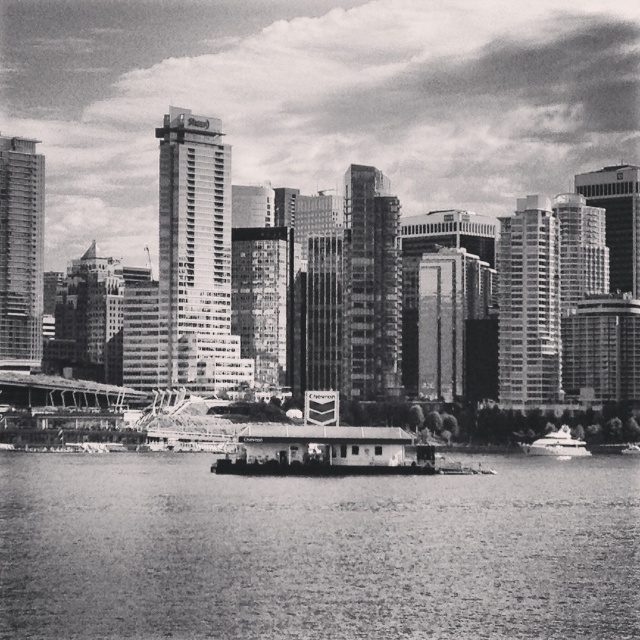
Question: Considering the relative positions of smooth water at center and white glossy boat at lower right in the image provided, where is smooth water at center located with respect to white glossy boat at lower right?

Choices:
 (A) left
 (B) right

Answer: (A)

Question: Does smooth water at center appear over white glossy boat at lower right?

Choices:
 (A) yes
 (B) no

Answer: (B)

Question: Among these points, which one is nearest to the camera?

Choices:
 (A) (563, 452)
 (B) (442, 595)

Answer: (B)

Question: Which object appears closest to the camera in this image?

Choices:
 (A) smooth water at center
 (B) white glossy boat at lower right

Answer: (A)

Question: Does smooth water at center appear over white glossy boat at lower right?

Choices:
 (A) no
 (B) yes

Answer: (A)